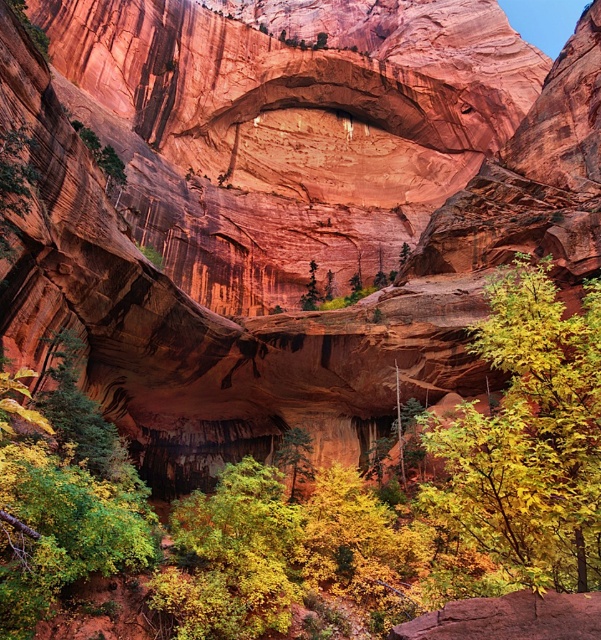
Question: Does yellow-green foliage at lower left have a greater width compared to reddish-brown rock at lower center?

Choices:
 (A) no
 (B) yes

Answer: (B)

Question: Which point is farther from the camera taking this photo?

Choices:
 (A) (296, 460)
 (B) (206, 518)
 (C) (58, 401)

Answer: (A)

Question: Which point appears closest to the camera in this image?

Choices:
 (A) (174, 636)
 (B) (43, 429)
 (C) (450, 524)
 (D) (519, 598)

Answer: (D)

Question: Among these points, which one is nearest to the camera?

Choices:
 (A) (281, 445)
 (B) (460, 628)
 (C) (203, 563)
 (D) (75, 522)

Answer: (B)

Question: Is yellow-green foliage at lower left positioned in front of yellow-green foliage at center?

Choices:
 (A) yes
 (B) no

Answer: (A)

Question: Is yellow-green foliage at lower right smaller than yellow-green foliage at center?

Choices:
 (A) no
 (B) yes

Answer: (A)